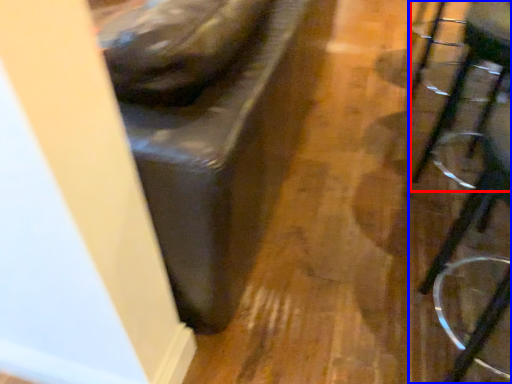
Question: Among these objects, which one is farthest to the camera, swivel chair (highlighted by a red box) or furniture (highlighted by a blue box)?

Choices:
 (A) swivel chair
 (B) furniture

Answer: (A)